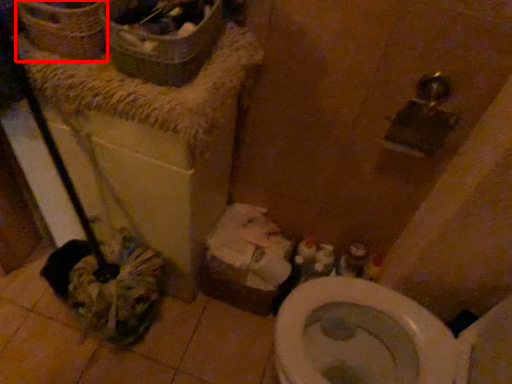
Question: Considering the relative positions of basket (annotated by the red box) and cardboard box in the image provided, where is basket (annotated by the red box) located with respect to the staircase?

Choices:
 (A) left
 (B) right

Answer: (A)